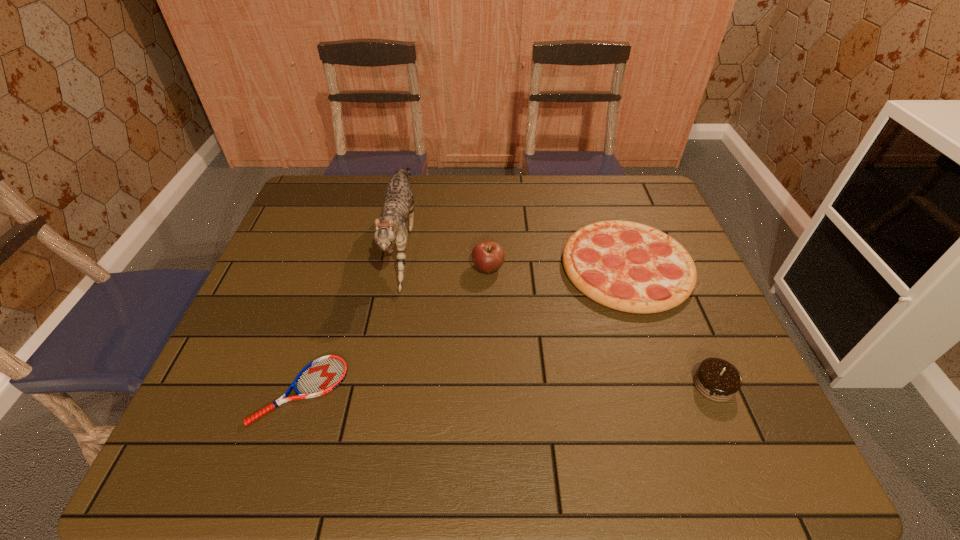
At what (x,y) coordinates should I click in order to perform the action: click on unoccupied position between the second shortest object and the third object from right to left. Please return your answer as a coordinate pair (x, y). This screenshot has height=540, width=960. Looking at the image, I should click on (558, 267).

Find the location of a particular element. The height and width of the screenshot is (540, 960). vacant region between the pizza and the third object from left to right is located at coordinates (558, 267).

This screenshot has width=960, height=540. Identify the location of object that stands as the closest to the apple. (627, 266).

Image resolution: width=960 pixels, height=540 pixels. In order to click on object that is the closest one to the second object from left to right in this screenshot , I will do `click(488, 256)`.

Where is `vacant area in the image that satisfies the following two spatial constraints: 1. on the side of the chocolate cake with the unique marking; 2. on the left side of the third object from right to left`? This screenshot has width=960, height=540. vacant area in the image that satisfies the following two spatial constraints: 1. on the side of the chocolate cake with the unique marking; 2. on the left side of the third object from right to left is located at coordinates (491, 385).

I want to click on vacant area in the image that satisfies the following two spatial constraints: 1. on the back side of the chocolate cake; 2. on the right side of the tennis racket, so click(302, 385).

Locate an element on the screen. The image size is (960, 540). free space that satisfies the following two spatial constraints: 1. on the side of the chocolate cake with the unique marking; 2. on the right side of the third object from right to left is located at coordinates (491, 385).

The width and height of the screenshot is (960, 540). Find the location of `free space that satisfies the following two spatial constraints: 1. on the back side of the fourth tallest object; 2. on the left side of the tennis racket`. free space that satisfies the following two spatial constraints: 1. on the back side of the fourth tallest object; 2. on the left side of the tennis racket is located at coordinates (340, 267).

This screenshot has width=960, height=540. Find the location of `vacant region that satisfies the following two spatial constraints: 1. on the face of the cat; 2. on the left side of the second shortest object`. vacant region that satisfies the following two spatial constraints: 1. on the face of the cat; 2. on the left side of the second shortest object is located at coordinates (396, 267).

You are a GUI agent. You are given a task and a screenshot of the screen. Output one action in this format:
    pyautogui.click(x=<x>, y=<y>)
    Task: Click on the free space that satisfies the following two spatial constraints: 1. on the face of the fourth object from right to left; 2. on the left side of the chocolate cake
    The image size is (960, 540).
    Given the screenshot: What is the action you would take?
    pyautogui.click(x=374, y=385)